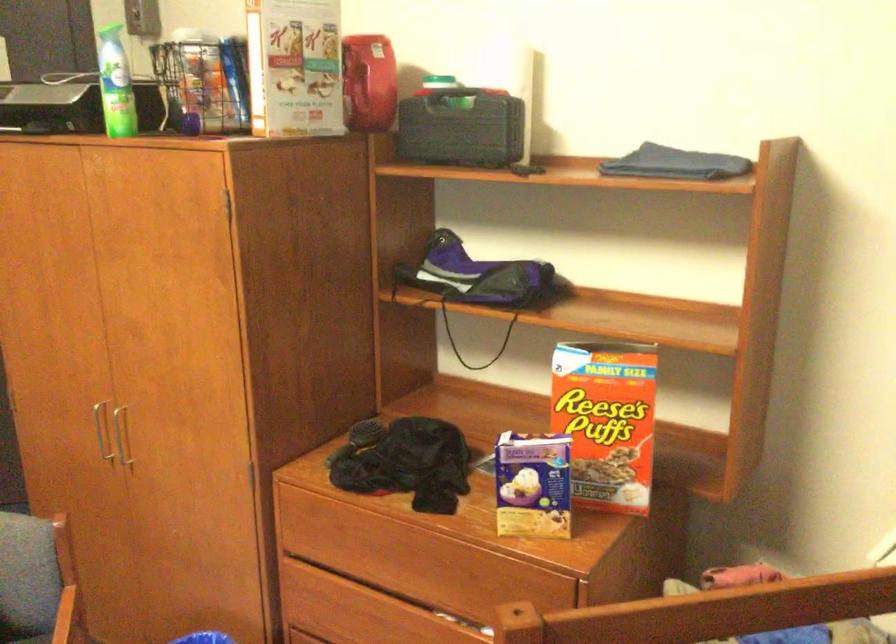
Find where to lift the black tool case. Please return your answer as a coordinate pair (x, y).

(461, 128)